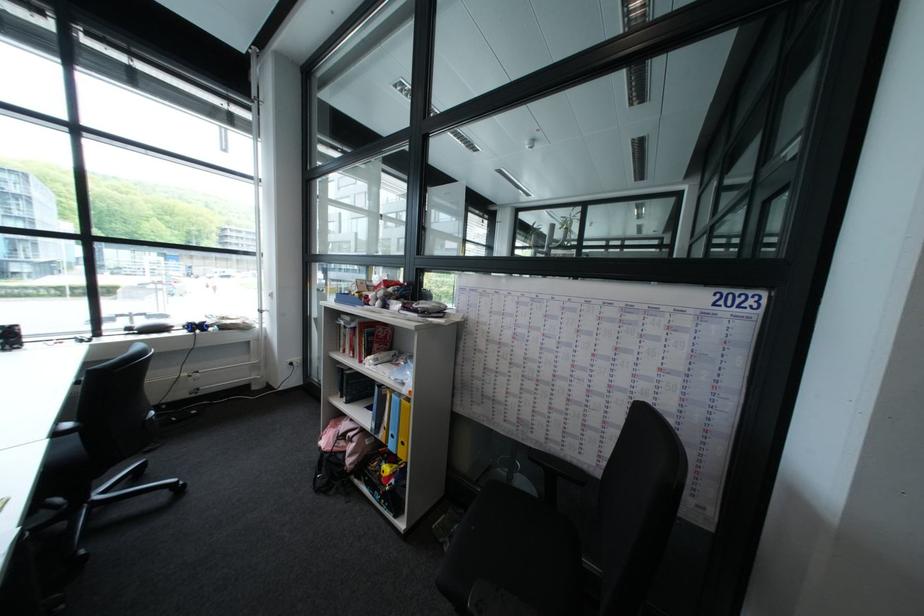
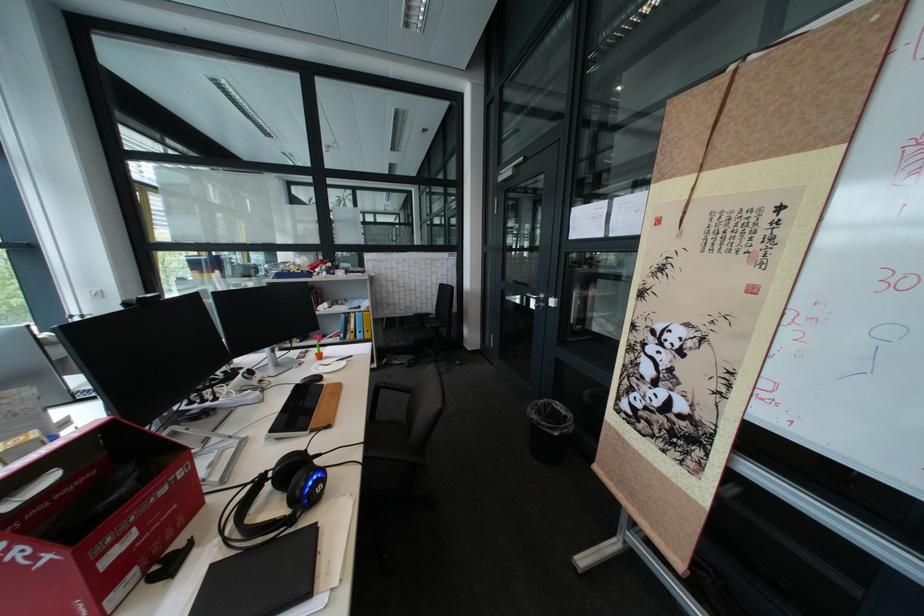
The point at (x=402, y=397) is marked in the first image. Where is the corresponding point in the second image?

(367, 315)